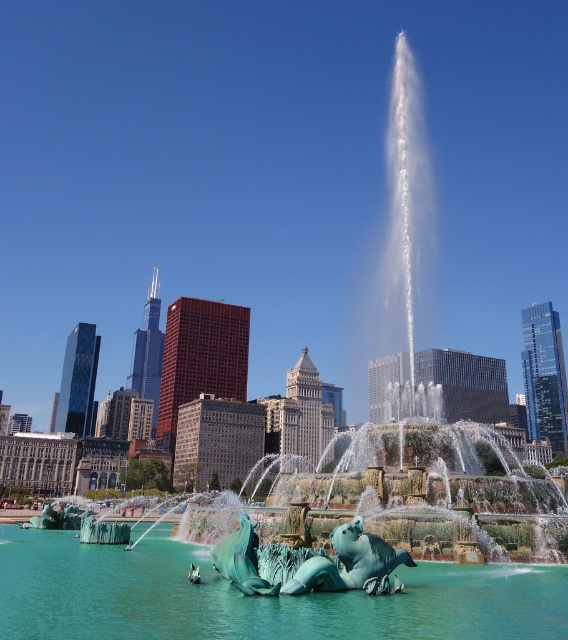
Does green marble sculpture at center have a lesser width compared to teal stone mermaid at lower center?

In fact, green marble sculpture at center might be wider than teal stone mermaid at lower center.

Who is more distant from viewer, [343,556] or [240,529]?

The point [240,529] is behind.

Does point (274, 584) lie behind point (243, 560)?

No.

At what (x,y) coordinates should I click in order to perform the action: click on green marble sculpture at center. Please return your answer as a coordinate pair (x, y). This screenshot has width=568, height=640. Looking at the image, I should click on 304,561.

Is teal glossy water at center positioned before green marble sculpture at center?

Yes, it is.

The width and height of the screenshot is (568, 640). What do you see at coordinates (253, 596) in the screenshot?
I see `teal glossy water at center` at bounding box center [253, 596].

Is point (532, 636) positioned before point (273, 552)?

Yes, point (532, 636) is in front of point (273, 552).

Where is `teal glossy water at center`? The height and width of the screenshot is (640, 568). teal glossy water at center is located at coordinates (253, 596).

Can you confirm if teal glossy water at center is thinner than teal stone mermaid at lower center?

No.

Between point (14, 545) and point (240, 538), which one is positioned in front?

Point (240, 538) is more forward.

Where is `teal glossy water at center`? The image size is (568, 640). teal glossy water at center is located at coordinates (253, 596).